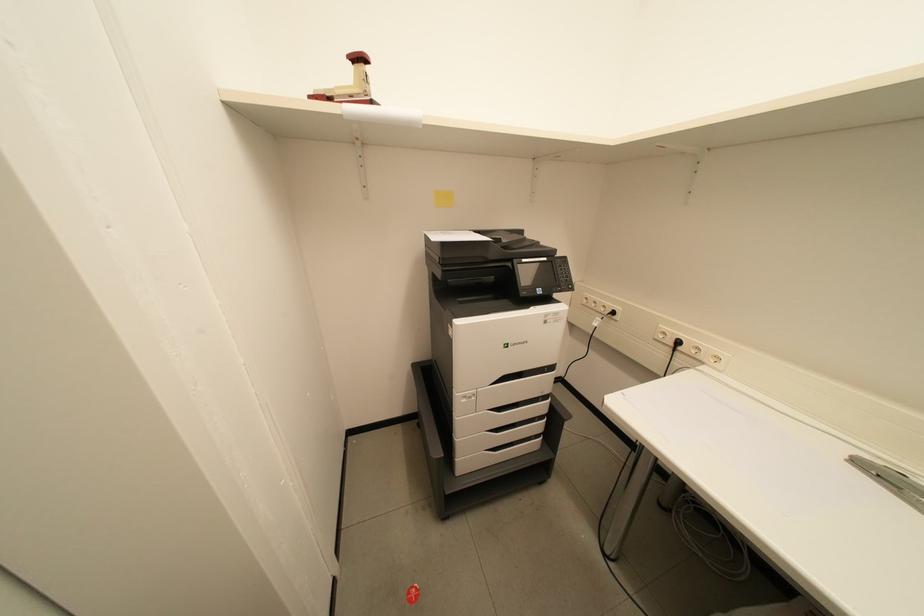
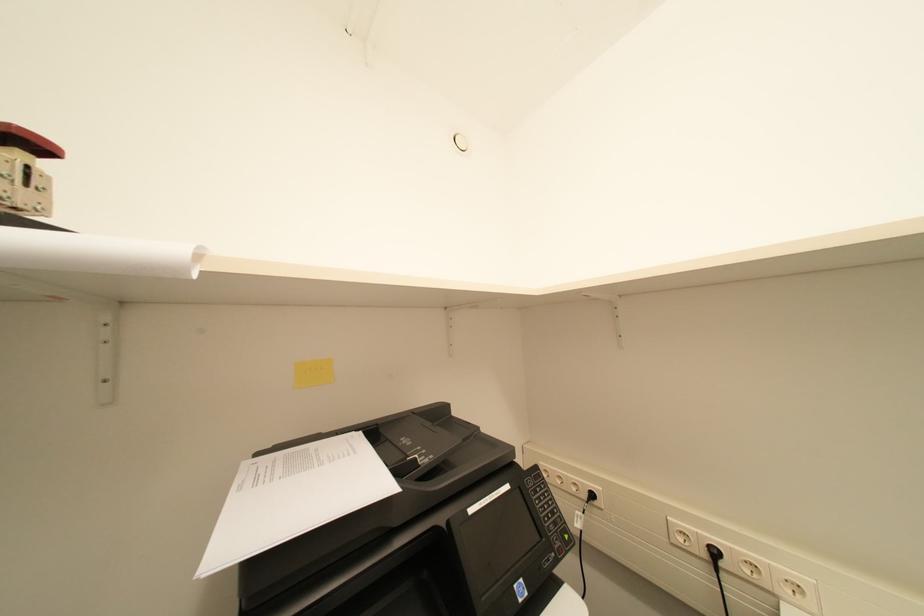
How did the camera likely rotate?

The rotation direction of the camera is right-up.